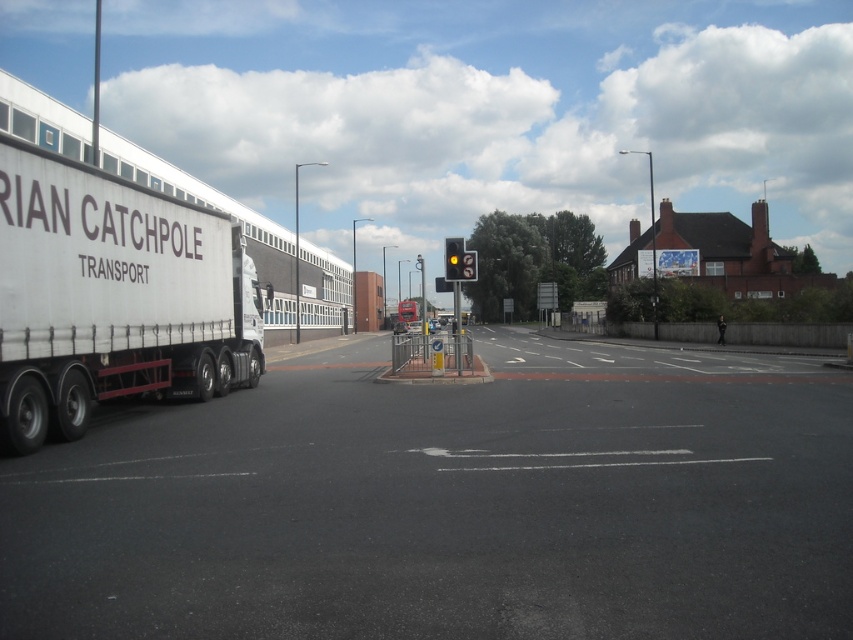
You are a delivery driver who needs to park the white matte trailer truck at left in a parking spot that can only accommodate vehicles narrower than the yellow matte traffic light at center. Can the truck fit in the spot based on their widths?

The white matte trailer truck at left is wider than the yellow matte traffic light at center, so it cannot fit in the parking spot designed for vehicles narrower than the traffic light.

You are a delivery driver who needs to park your truck in a space that can only accommodate vehicles up to the size of the yellow matte traffic light at center. Can your white matte trailer truck at left fit in the space?

The white matte trailer truck at left is bigger than the yellow matte traffic light at center, so it cannot fit in the space designated for vehicles up to the size of the yellow matte traffic light at center.

You are standing at the camera position and want to reach the point at coordinates (68, 397) as quickly as possible. Considering the scene described, what is the shortest path you can take without crossing any traffic lanes?

The shortest path to the point at coordinates (68, 397) would be to move directly towards it along the sidewalk or pedestrian path, as the point is 10.61 meters away from the camera and positioned near the pedestrian crossing with a group of people nearby, indicating a safe and accessible route.